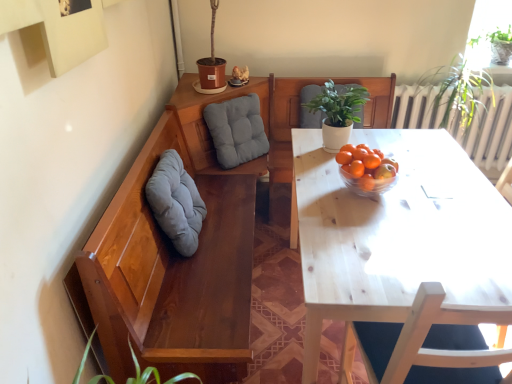
Question: From a real-world perspective, is green matte plant at upper center located beneath soft gray cushion at left, the second gray when ordered from back to front?

Choices:
 (A) no
 (B) yes

Answer: (A)

Question: Considering the relative sizes of green matte plant at upper center and soft gray cushion at left, the first gray from the front, in the image provided, is green matte plant at upper center bigger than soft gray cushion at left, the first gray from the front,?

Choices:
 (A) yes
 (B) no

Answer: (B)

Question: Are green matte plant at upper center and soft gray cushion at left, the second gray when ordered from back to front, far apart?

Choices:
 (A) yes
 (B) no

Answer: (B)

Question: Does green matte plant at upper center have a lesser width compared to soft gray cushion at left, the second gray when ordered from back to front?

Choices:
 (A) yes
 (B) no

Answer: (B)

Question: Considering the relative sizes of green matte plant at upper center and soft gray cushion at left, the first gray from the front, in the image provided, is green matte plant at upper center taller than soft gray cushion at left, the first gray from the front,?

Choices:
 (A) yes
 (B) no

Answer: (B)

Question: In the image, is green matte plant at upper center positioned in front of or behind light wood table at center?

Choices:
 (A) behind
 (B) front

Answer: (A)

Question: Do you think green matte plant at upper center is within light wood table at center, or outside of it?

Choices:
 (A) inside
 (B) outside

Answer: (B)

Question: From the image's perspective, relative to light wood table at center, is green matte plant at upper center above or below?

Choices:
 (A) below
 (B) above

Answer: (B)

Question: Visually, is green matte plant at upper center positioned to the left or to the right of light wood table at center?

Choices:
 (A) left
 (B) right

Answer: (A)

Question: In terms of width, does soft gray cushion at left, the first gray from the front, look wider or thinner when compared to light wood table at center?

Choices:
 (A) wide
 (B) thin

Answer: (B)

Question: From the image's perspective, relative to light wood table at center, is soft gray cushion at left, the first gray from the front, above or below?

Choices:
 (A) above
 (B) below

Answer: (A)

Question: Considering the positions of soft gray cushion at left, the second gray when ordered from back to front, and light wood table at center in the image, is soft gray cushion at left, the second gray when ordered from back to front, taller or shorter than light wood table at center?

Choices:
 (A) tall
 (B) short

Answer: (B)

Question: Do you think soft gray cushion at left, the second gray when ordered from back to front, is within light wood table at center, or outside of it?

Choices:
 (A) outside
 (B) inside

Answer: (A)

Question: Considering their positions, is matte gray cushion at center, which is counted as the 1th gray, starting from the back, located in front of or behind light wood table at center?

Choices:
 (A) front
 (B) behind

Answer: (B)

Question: From their relative heights in the image, would you say matte gray cushion at center, which is counted as the 1th gray, starting from the back, is taller or shorter than light wood table at center?

Choices:
 (A) tall
 (B) short

Answer: (B)